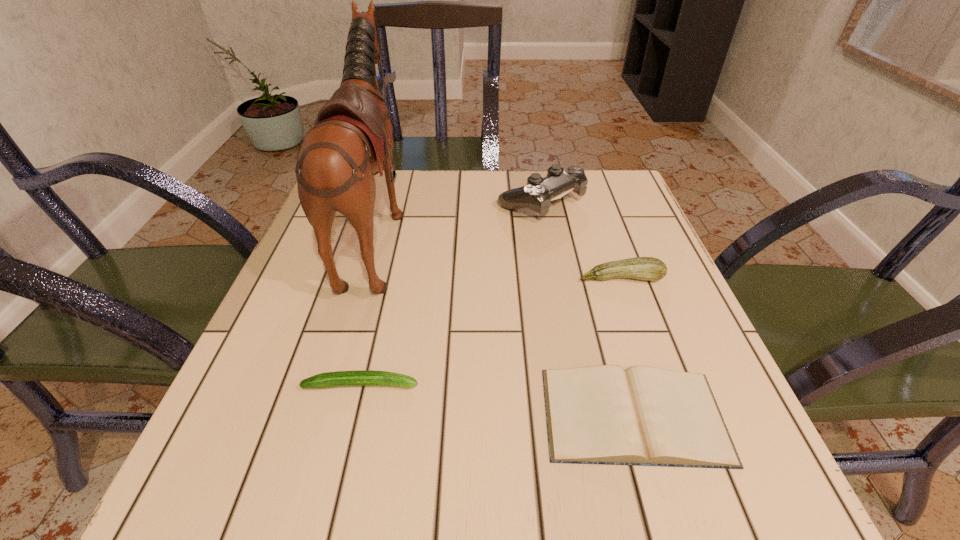
Where is `unoccupied position between the shorter zucchini and the farther zucchini`? The height and width of the screenshot is (540, 960). unoccupied position between the shorter zucchini and the farther zucchini is located at coordinates (492, 332).

The height and width of the screenshot is (540, 960). What are the coordinates of `free spot between the Bible and the saddle` in the screenshot? It's located at (506, 324).

In order to click on empty space between the tallest object and the second tallest object in this screenshot , I will do `click(459, 217)`.

At what (x,y) coordinates should I click in order to perform the action: click on vacant space that's between the left zucchini and the tallest object. Please return your answer as a coordinate pair (x, y). Looking at the image, I should click on (370, 308).

Identify the location of free point between the saddle and the Bible. The image size is (960, 540). (506, 324).

The height and width of the screenshot is (540, 960). Identify the location of vacant area between the tallest object and the second tallest object. (x=459, y=217).

Find the location of `vacant point located between the left zucchini and the second tallest object`. vacant point located between the left zucchini and the second tallest object is located at coordinates (451, 293).

This screenshot has width=960, height=540. In order to click on free area in between the farther zucchini and the left zucchini in this screenshot , I will do `click(492, 332)`.

The width and height of the screenshot is (960, 540). I want to click on blank region between the tallest object and the right zucchini, so click(499, 255).

Locate an element on the screen. The width and height of the screenshot is (960, 540). object that is the second nearest to the fourth shortest object is located at coordinates (352, 140).